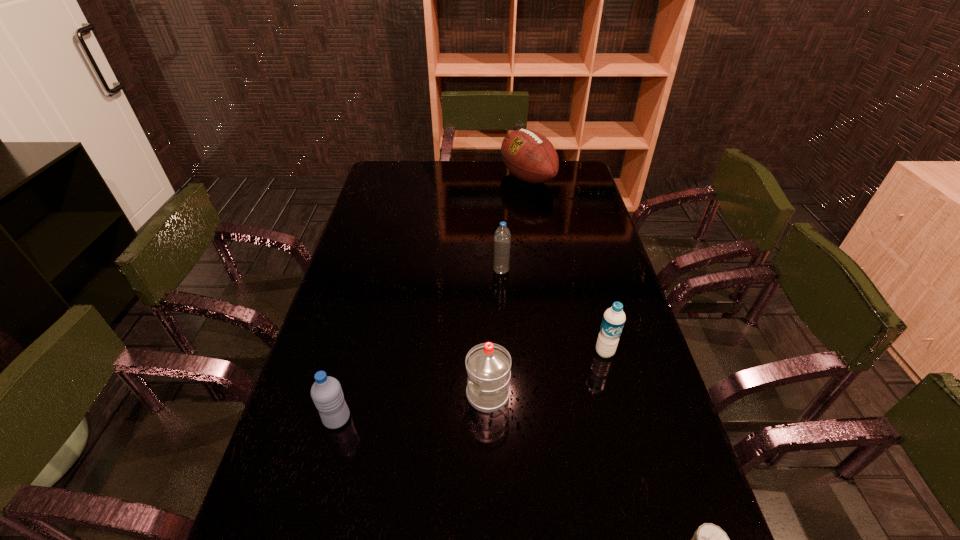
I want to click on free spot between the farthest water bottle and the football (American), so click(x=515, y=224).

At what (x,y) coordinates should I click in order to perform the action: click on vacant space that's between the farthest water bottle and the leftmost water bottle. Please return your answer as a coordinate pair (x, y). Looking at the image, I should click on (419, 345).

Image resolution: width=960 pixels, height=540 pixels. Identify the location of blank region between the fifth nearest object and the farthest object. (515, 224).

Point out which object is positioned as the second nearest to the farthest water bottle. Please provide its 2D coordinates. Your answer should be formatted as a tuple, i.e. [(x, y)], where the tuple contains the x and y coordinates of a point satisfying the conditions above.

[(488, 365)]

Where is `object that is the second closest to the football (American)`? The height and width of the screenshot is (540, 960). object that is the second closest to the football (American) is located at coordinates (614, 318).

Choose which water bottle is the third nearest neighbor to the third farthest object. Please provide its 2D coordinates. Your answer should be formatted as a tuple, i.e. [(x, y)], where the tuple contains the x and y coordinates of a point satisfying the conditions above.

[(326, 392)]

Find the location of a particular element. The width and height of the screenshot is (960, 540). water bottle that is the third nearest to the medicine is located at coordinates (x=326, y=392).

You are a GUI agent. You are given a task and a screenshot of the screen. Output one action in this format:
    pyautogui.click(x=<x>, y=<y>)
    Task: Click on the vacant space that satisfies the following two spatial constraints: 1. on the back side of the football (American); 2. on the right side of the fifth nearest object
    The image size is (960, 540).
    Given the screenshot: What is the action you would take?
    pyautogui.click(x=496, y=178)